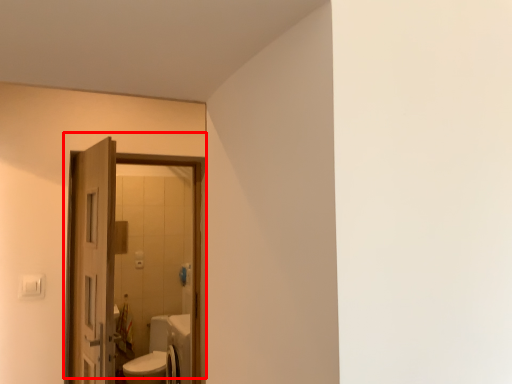
Question: From the image's perspective, considering the relative positions of door (annotated by the red box) and door in the image provided, where is door (annotated by the red box) located with respect to the staircase?

Choices:
 (A) below
 (B) above

Answer: (B)